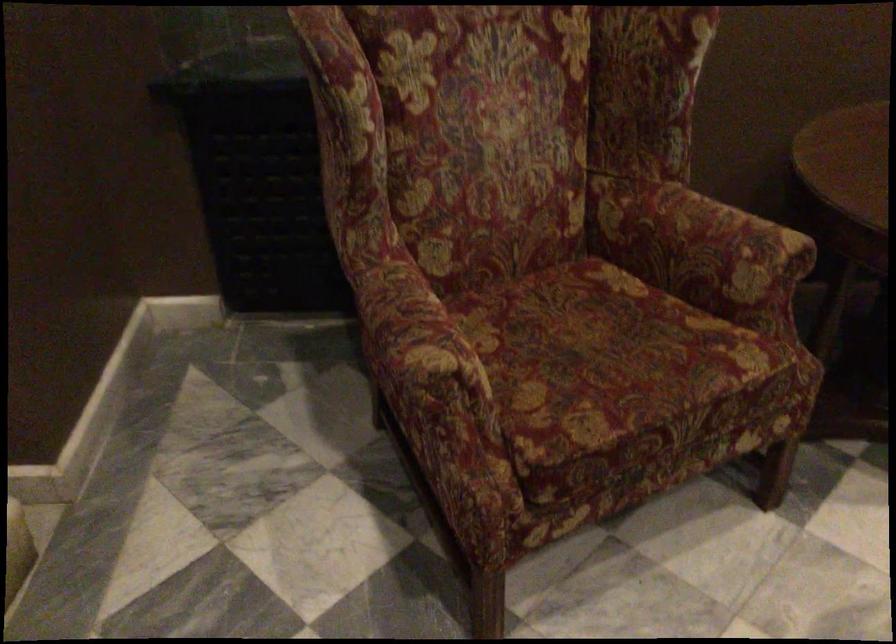
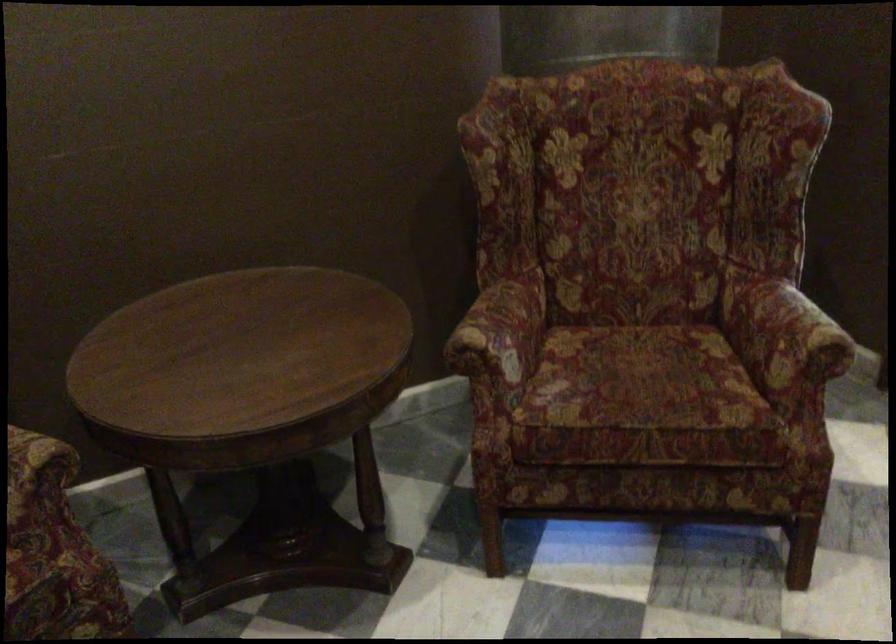
Question: The images are taken continuously from a first-person perspective. In which direction are you moving?

Choices:
 (A) Left
 (B) Right
 (C) Forward
 (D) Backward

Answer: (B)